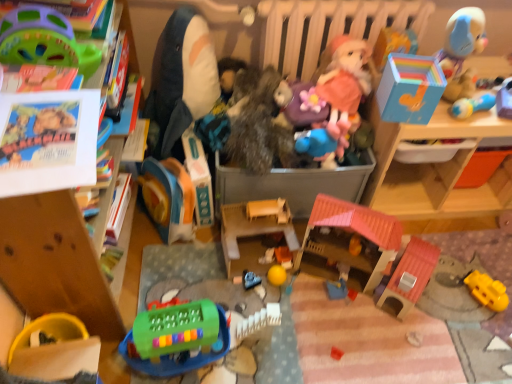
Locate an element on the screen. The image size is (512, 384). free space in front of yellow plastic blocks at lower right, acting as the fifteenth toy starting from the left is located at coordinates (483, 337).